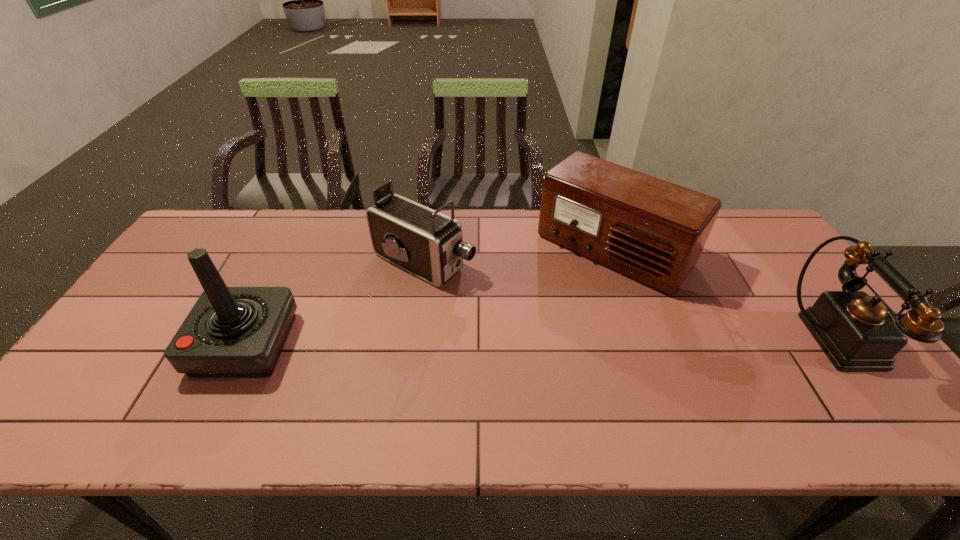
Image resolution: width=960 pixels, height=540 pixels. In the image, there is a desktop. What are the coordinates of `free space at the far edge` in the screenshot? It's located at (463, 232).

Locate an element on the screen. The image size is (960, 540). vacant space at the near edge is located at coordinates (309, 389).

What are the coordinates of `vacant space at the left edge` in the screenshot? It's located at (156, 316).

Image resolution: width=960 pixels, height=540 pixels. Find the location of `vacant space at the right edge of the desktop`. vacant space at the right edge of the desktop is located at coordinates (762, 293).

In the image, there is a desktop. Where is `free space at the far left corner`? free space at the far left corner is located at coordinates (219, 243).

Find the location of `free spot at the far right corner of the desktop`. free spot at the far right corner of the desktop is located at coordinates (737, 217).

Image resolution: width=960 pixels, height=540 pixels. I want to click on free space that is in between the telephone and the camcorder, so click(x=628, y=300).

Identify the location of free point between the telephone and the camcorder. The width and height of the screenshot is (960, 540). (628, 300).

Identify the location of free space that is in between the third object from right to left and the joystick. (335, 303).

Identify the location of empty location between the tallest object and the second object from left to right. (335, 303).